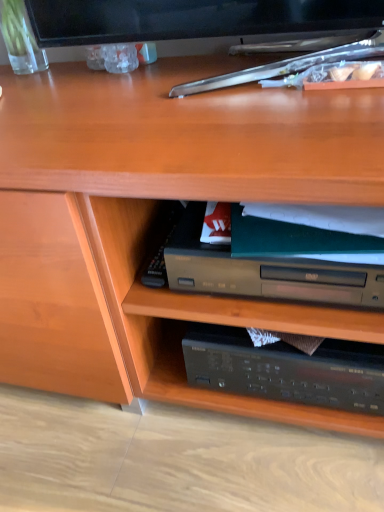
Question: From the image's perspective, relative to green matte paperback book at center, is clear glass vase at upper left above or below?

Choices:
 (A) above
 (B) below

Answer: (A)

Question: Is clear glass vase at upper left spatially inside green matte paperback book at center, or outside of it?

Choices:
 (A) outside
 (B) inside

Answer: (A)

Question: From a real-world perspective, relative to green matte paperback book at center, is clear glass vase at upper left vertically above or below?

Choices:
 (A) above
 (B) below

Answer: (A)

Question: Considering the relative positions of green matte paperback book at center and clear glass vase at upper left in the image provided, is green matte paperback book at center to the left or to the right of clear glass vase at upper left?

Choices:
 (A) left
 (B) right

Answer: (B)

Question: From a real-world perspective, is green matte paperback book at center physically located above or below clear glass vase at upper left?

Choices:
 (A) above
 (B) below

Answer: (B)

Question: From the image's perspective, is green matte paperback book at center above or below clear glass vase at upper left?

Choices:
 (A) above
 (B) below

Answer: (B)

Question: Is point pyautogui.click(x=226, y=287) closer or farther from the camera than point pyautogui.click(x=16, y=19)?

Choices:
 (A) closer
 (B) farther

Answer: (A)